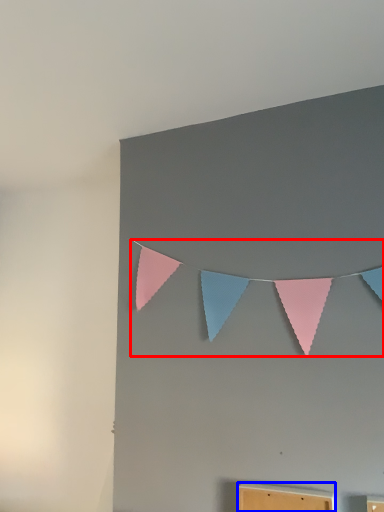
Question: Which of the following is the closest to the observer, clothesline (highlighted by a red box) or furniture (highlighted by a blue box)?

Choices:
 (A) clothesline
 (B) furniture

Answer: (B)